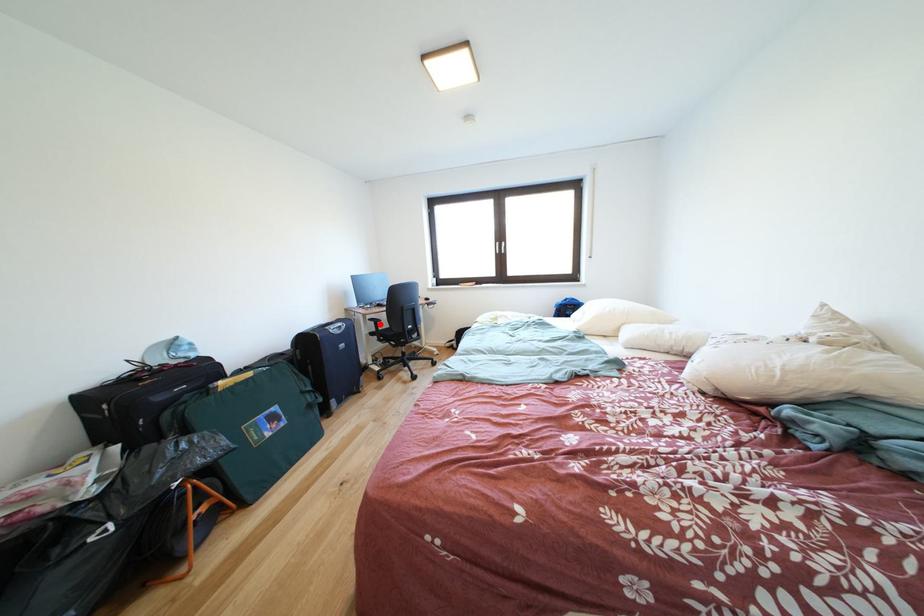
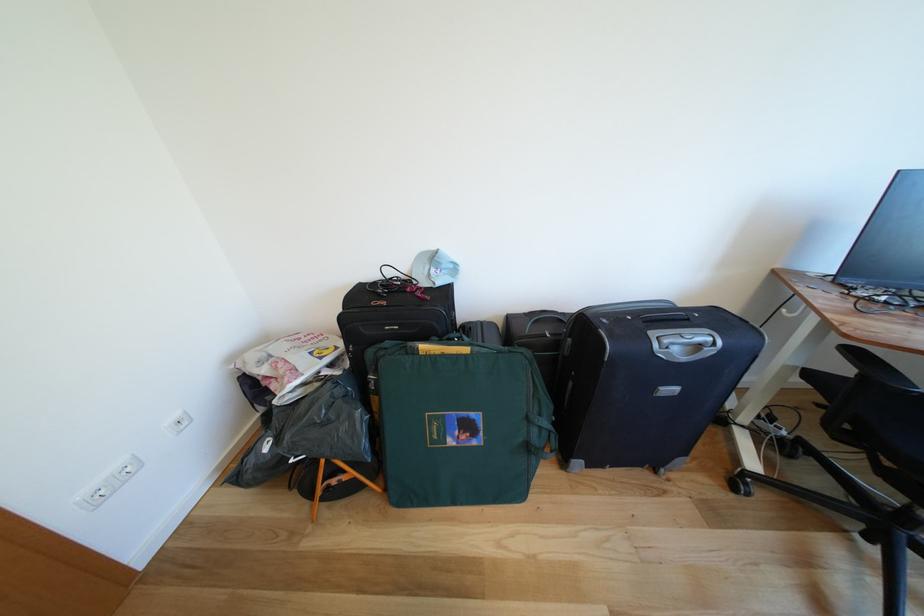
The point at the highlighted location is marked in the first image. Where is the corresponding point in the second image?

(862, 357)